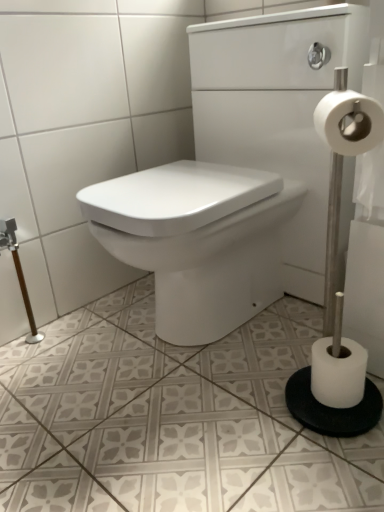
Question: From the image's perspective, is white glossy sink at center located beneath white matte toilet paper at right?

Choices:
 (A) yes
 (B) no

Answer: (B)

Question: Is white glossy sink at center far away from white matte toilet paper at right?

Choices:
 (A) yes
 (B) no

Answer: (B)

Question: Does white glossy sink at center have a larger size compared to white matte toilet paper at right?

Choices:
 (A) yes
 (B) no

Answer: (A)

Question: Is white matte toilet paper at right at the back of white glossy sink at center?

Choices:
 (A) no
 (B) yes

Answer: (A)

Question: Could you tell me if white glossy sink at center is facing white matte toilet paper at right?

Choices:
 (A) yes
 (B) no

Answer: (B)

Question: Does white glossy sink at center have a greater height compared to white matte toilet paper at right?

Choices:
 (A) yes
 (B) no

Answer: (A)

Question: Is there a large distance between white matte toilet paper at right and white glossy sink at center?

Choices:
 (A) yes
 (B) no

Answer: (B)

Question: Is white matte toilet paper at right thinner than white glossy sink at center?

Choices:
 (A) yes
 (B) no

Answer: (A)

Question: Can white glossy sink at center be found inside white matte toilet paper at right?

Choices:
 (A) yes
 (B) no

Answer: (B)

Question: Is the depth of white matte toilet paper at right greater than that of white glossy sink at center?

Choices:
 (A) no
 (B) yes

Answer: (B)

Question: Considering the relative positions of white matte toilet paper at right and white glossy sink at center in the image provided, is white matte toilet paper at right to the left of white glossy sink at center from the viewer's perspective?

Choices:
 (A) yes
 (B) no

Answer: (B)

Question: From the image's perspective, is white matte toilet paper at right on top of white glossy sink at center?

Choices:
 (A) yes
 (B) no

Answer: (B)

Question: Looking at their shapes, would you say white glossy sink at center is wider or thinner than white matte toilet paper at right?

Choices:
 (A) wide
 (B) thin

Answer: (A)